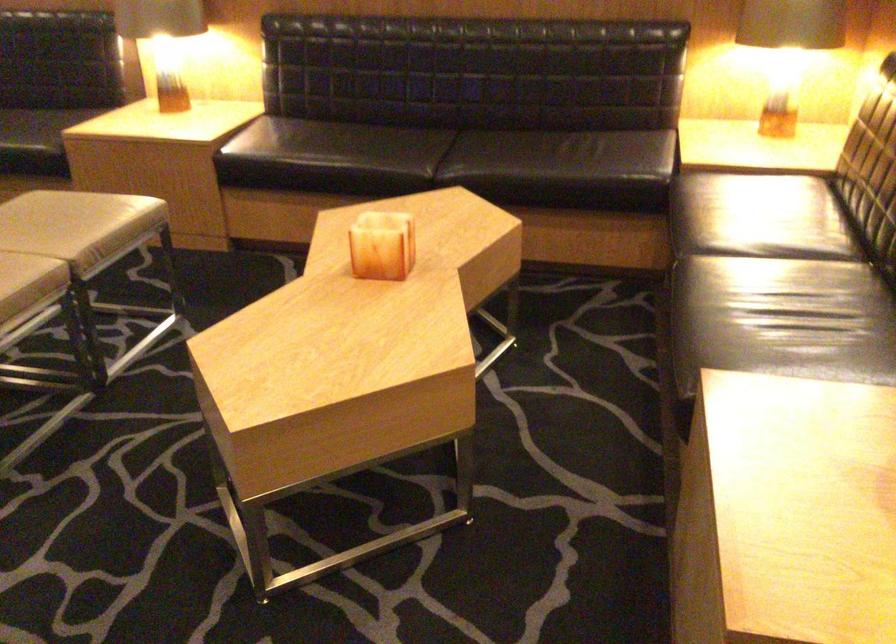
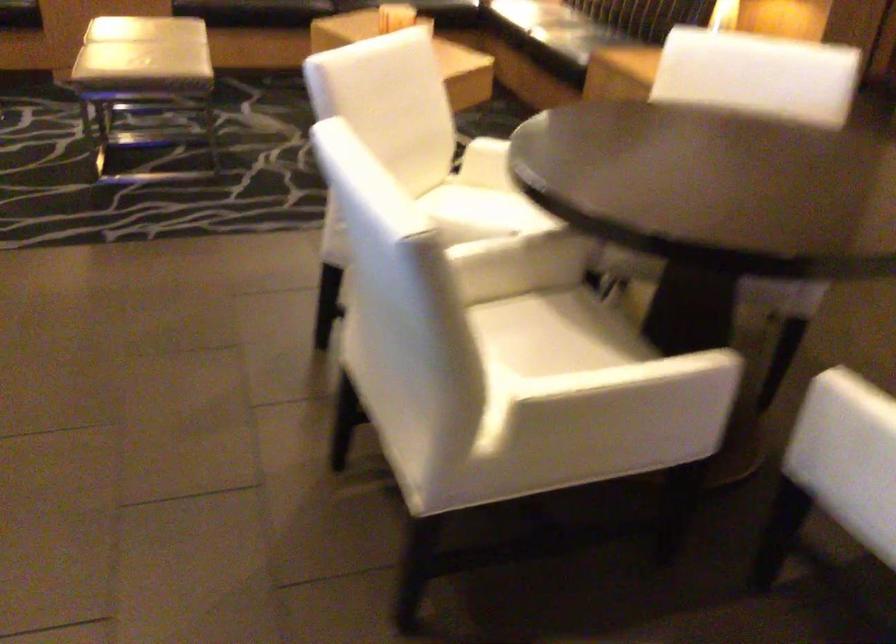
Consider the image. What movement of the cameraman would produce the second image?

The cameraman walked toward left, backward.